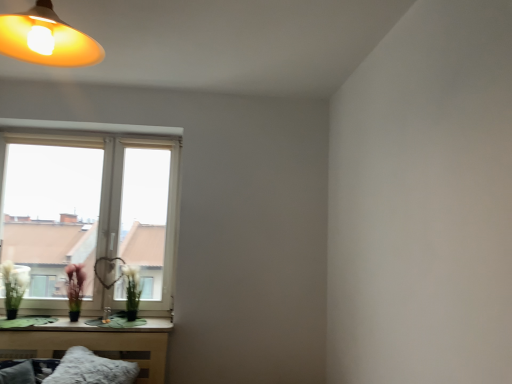
This screenshot has height=384, width=512. What are the coordinates of `green matte plant at window, placed as the 1th flower when sorted from right to left` in the screenshot? It's located at (132, 286).

Measure the distance between point (74, 310) and camera.

3.10 meters.

Find the location of a particular element. The height and width of the screenshot is (384, 512). green matte flower at lower left, acting as the 1th flower starting from the left is located at coordinates (75, 287).

Describe the element at coordinates (14, 286) in the screenshot. This screenshot has height=384, width=512. I see `green matte vase at lower left` at that location.

Identify the location of fuzzy white pillow at lower left. (91, 369).

This screenshot has width=512, height=384. In order to click on green matte plant at window, placed as the 1th flower when sorted from right to left in this screenshot , I will do `click(132, 286)`.

Considering the relative positions of green matte vase at lower left and white plastic window at lower left in the image provided, is green matte vase at lower left behind white plastic window at lower left?

No, green matte vase at lower left is closer to the camera.

From a real-world perspective, which object rests below the other?

green matte vase at lower left, from a real-world perspective.

Does green matte vase at lower left have a greater width compared to white plastic window at lower left?

Yes, green matte vase at lower left is wider than white plastic window at lower left.

From a real-world perspective, which is physically above, white plastic window at lower left or green matte vase at lower left?

white plastic window at lower left is physically above.

Find the location of `floral arrangement below the white plastic window at lower left (from a real-world perspective)`. floral arrangement below the white plastic window at lower left (from a real-world perspective) is located at coordinates coord(14,286).

Which object is further away from the camera, white plastic window at lower left or green matte vase at lower left?

white plastic window at lower left is more distant.

Considering the relative positions of white plastic window at lower left and green matte vase at lower left in the image provided, is white plastic window at lower left to the left or to the right of green matte vase at lower left?

From the image, it's evident that white plastic window at lower left is to the right of green matte vase at lower left.

In the scene shown: Considering the positions of objects green matte vase at lower left and green matte flower at lower left, which is the 2th flower from right to left, in the image provided, who is in front, green matte vase at lower left or green matte flower at lower left, which is the 2th flower from right to left,?

green matte vase at lower left.

Is green matte flower at lower left, acting as the 1th flower starting from the left, at the back of green matte vase at lower left?

No, green matte flower at lower left, acting as the 1th flower starting from the left, is not at the back of green matte vase at lower left.

Looking at this image, from the image's perspective, would you say green matte vase at lower left is positioned over green matte flower at lower left, which is the 2th flower from right to left?

Yes, from the image's perspective, green matte vase at lower left is over green matte flower at lower left, which is the 2th flower from right to left.

Which of these two, green matte vase at lower left or green matte flower at lower left, which is the 2th flower from right to left, is wider?

With larger width is green matte vase at lower left.

From the picture: From the image's perspective, is green matte flower at lower left, acting as the 1th flower starting from the left, located above green matte vase at lower left?

Actually, green matte flower at lower left, acting as the 1th flower starting from the left, appears below green matte vase at lower left in the image.

Is green matte flower at lower left, which is the 2th flower from right to left, taller or shorter than green matte vase at lower left?

Clearly, green matte flower at lower left, which is the 2th flower from right to left, is shorter compared to green matte vase at lower left.

What's the angular difference between green matte flower at lower left, which is the 2th flower from right to left, and green matte vase at lower left's facing directions?

There is a 0.725-degree angle between the facing directions of green matte flower at lower left, which is the 2th flower from right to left, and green matte vase at lower left.

Is green matte flower at lower left, acting as the 1th flower starting from the left, facing away from green matte vase at lower left?

green matte flower at lower left, acting as the 1th flower starting from the left, is not turned away from green matte vase at lower left.

Considering the points (13, 285) and (135, 309), which point is in front, point (13, 285) or point (135, 309)?

Positioned in front is point (13, 285).

In the scene shown: Is green matte vase at lower left in front of or behind green matte plant at window, placed as the 1th flower when sorted from right to left, in the image?

Visually, green matte vase at lower left is located in front of green matte plant at window, placed as the 1th flower when sorted from right to left.

Does green matte vase at lower left have a greater width compared to green matte plant at window, arranged as the 2th flower when viewed from the left?

Correct, the width of green matte vase at lower left exceeds that of green matte plant at window, arranged as the 2th flower when viewed from the left.

How far apart are green matte vase at lower left and green matte plant at window, placed as the 1th flower when sorted from right to left?

29.81 inches.

Between green matte flower at lower left, acting as the 1th flower starting from the left, and fuzzy white pillow at lower left, which one has larger width?

With larger width is fuzzy white pillow at lower left.

Can you confirm if green matte flower at lower left, which is the 2th flower from right to left, is positioned to the right of fuzzy white pillow at lower left?

No, green matte flower at lower left, which is the 2th flower from right to left, is not to the right of fuzzy white pillow at lower left.

How much distance is there between green matte flower at lower left, acting as the 1th flower starting from the left, and fuzzy white pillow at lower left?

green matte flower at lower left, acting as the 1th flower starting from the left, is 22.42 inches from fuzzy white pillow at lower left.

Looking at the image, does green matte flower at lower left, which is the 2th flower from right to left, seem bigger or smaller compared to fuzzy white pillow at lower left?

In the image, green matte flower at lower left, which is the 2th flower from right to left, appears to be smaller than fuzzy white pillow at lower left.

Which object is positioned more to the right, green matte plant at window, placed as the 1th flower when sorted from right to left, or green matte vase at lower left?

green matte plant at window, placed as the 1th flower when sorted from right to left, is more to the right.

Considering the relative sizes of green matte plant at window, arranged as the 2th flower when viewed from the left, and green matte vase at lower left in the image provided, is green matte plant at window, arranged as the 2th flower when viewed from the left, taller than green matte vase at lower left?

Incorrect, the height of green matte plant at window, arranged as the 2th flower when viewed from the left, is not larger of that of green matte vase at lower left.

Is green matte plant at window, placed as the 1th flower when sorted from right to left, positioned with its back to green matte vase at lower left?

No, green matte plant at window, placed as the 1th flower when sorted from right to left, is not facing away from green matte vase at lower left.

From the picture: Considering the relative sizes of green matte plant at window, arranged as the 2th flower when viewed from the left, and green matte vase at lower left in the image provided, is green matte plant at window, arranged as the 2th flower when viewed from the left, bigger than green matte vase at lower left?

Actually, green matte plant at window, arranged as the 2th flower when viewed from the left, might be smaller than green matte vase at lower left.

In order to click on floral arrangement on the left of white plastic window at lower left in this screenshot , I will do `click(14, 286)`.

In order to click on window lying above the green matte vase at lower left (from the image's perspective) in this screenshot , I will do `click(89, 210)`.

Which object lies further to the anchor point green matte flower at lower left, which is the 2th flower from right to left, fuzzy white pillow at lower left or white plastic window at lower left?

fuzzy white pillow at lower left is positioned further to the anchor green matte flower at lower left, which is the 2th flower from right to left.

Looking at the image, which one is located further to green matte plant at window, arranged as the 2th flower when viewed from the left, green matte vase at lower left or green matte flower at lower left, which is the 2th flower from right to left?

Based on the image, green matte vase at lower left appears to be further to green matte plant at window, arranged as the 2th flower when viewed from the left.

Based on their spatial positions, is green matte plant at window, arranged as the 2th flower when viewed from the left, or green matte vase at lower left closer to white plastic window at lower left?

green matte plant at window, arranged as the 2th flower when viewed from the left, is closer to white plastic window at lower left.

Looking at this image, when comparing their distances from white plastic window at lower left, does green matte flower at lower left, which is the 2th flower from right to left, or green matte vase at lower left seem further?

green matte vase at lower left lies further to white plastic window at lower left than the other object.

Estimate the real-world distances between objects in this image. Which object is closer to green matte flower at lower left, which is the 2th flower from right to left, white plastic window at lower left or green matte plant at window, arranged as the 2th flower when viewed from the left?

Among the two, green matte plant at window, arranged as the 2th flower when viewed from the left, is located nearer to green matte flower at lower left, which is the 2th flower from right to left.

Estimate the real-world distances between objects in this image. Which object is further from fuzzy white pillow at lower left, green matte vase at lower left or green matte plant at window, placed as the 1th flower when sorted from right to left?

green matte vase at lower left.

When comparing their distances from green matte flower at lower left, which is the 2th flower from right to left, does white plastic window at lower left or green matte vase at lower left seem closer?

green matte vase at lower left is positioned closer to the anchor green matte flower at lower left, which is the 2th flower from right to left.

Looking at the image, which one is located closer to green matte plant at window, placed as the 1th flower when sorted from right to left, fuzzy white pillow at lower left or green matte flower at lower left, which is the 2th flower from right to left?

green matte flower at lower left, which is the 2th flower from right to left, is closer to green matte plant at window, placed as the 1th flower when sorted from right to left.

The image size is (512, 384). Identify the location of pillow situated between green matte vase at lower left and green matte plant at window, arranged as the 2th flower when viewed from the left, from left to right. (91, 369).

Where is `flower between fuzzy white pillow at lower left and green matte plant at window, placed as the 1th flower when sorted from right to left, in the front-back direction`? Image resolution: width=512 pixels, height=384 pixels. flower between fuzzy white pillow at lower left and green matte plant at window, placed as the 1th flower when sorted from right to left, in the front-back direction is located at coordinates (75, 287).

Locate an element on the screen. Image resolution: width=512 pixels, height=384 pixels. flower between white plastic window at lower left and green matte plant at window, arranged as the 2th flower when viewed from the left, in the vertical direction is located at coordinates (75, 287).

Locate an element on the screen. The height and width of the screenshot is (384, 512). floral arrangement that lies between white plastic window at lower left and green matte flower at lower left, which is the 2th flower from right to left, from top to bottom is located at coordinates (14, 286).